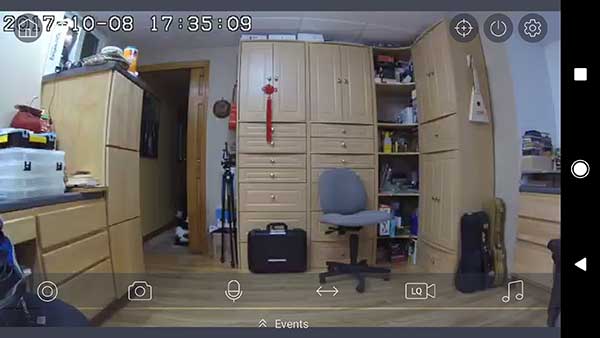
Locate an element on the screen. The height and width of the screenshot is (338, 600). black tripod stand is located at coordinates (226, 185).